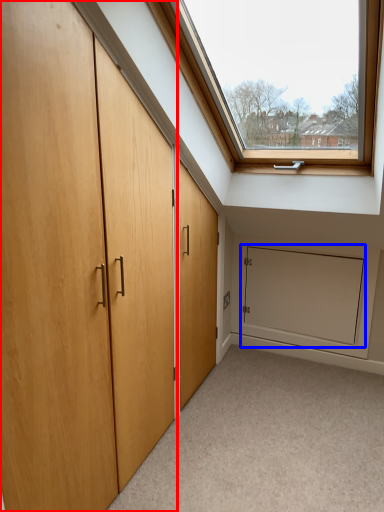
Question: Among these objects, which one is farthest to the camera, door (highlighted by a red box) or screen door (highlighted by a blue box)?

Choices:
 (A) door
 (B) screen door

Answer: (B)